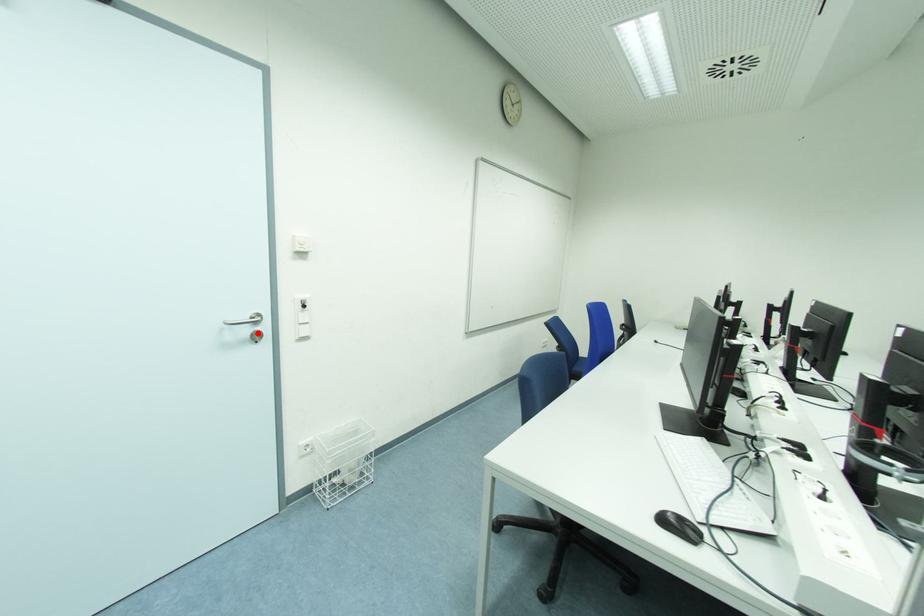
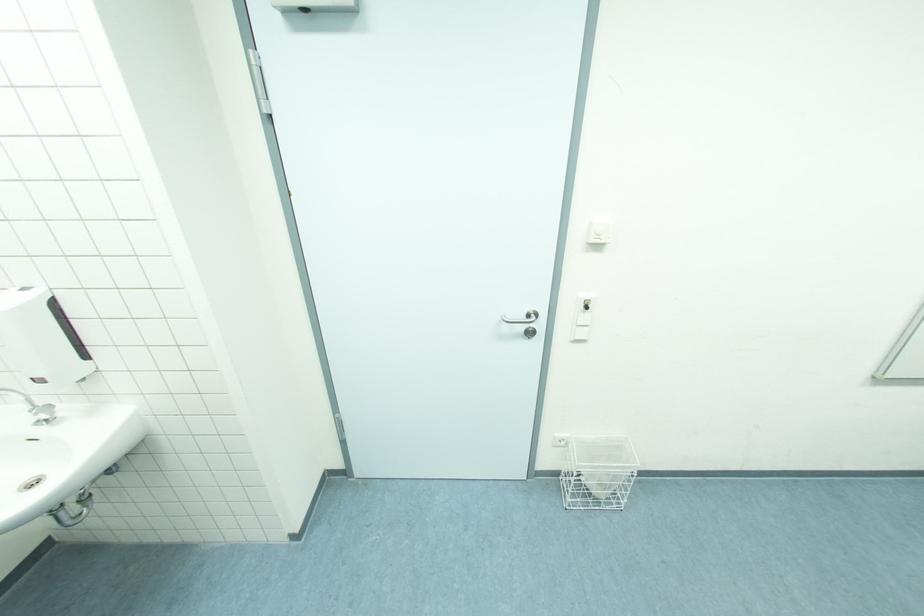
Find the pixel in the second image that matches the highlighted location in the first image.

(532, 329)